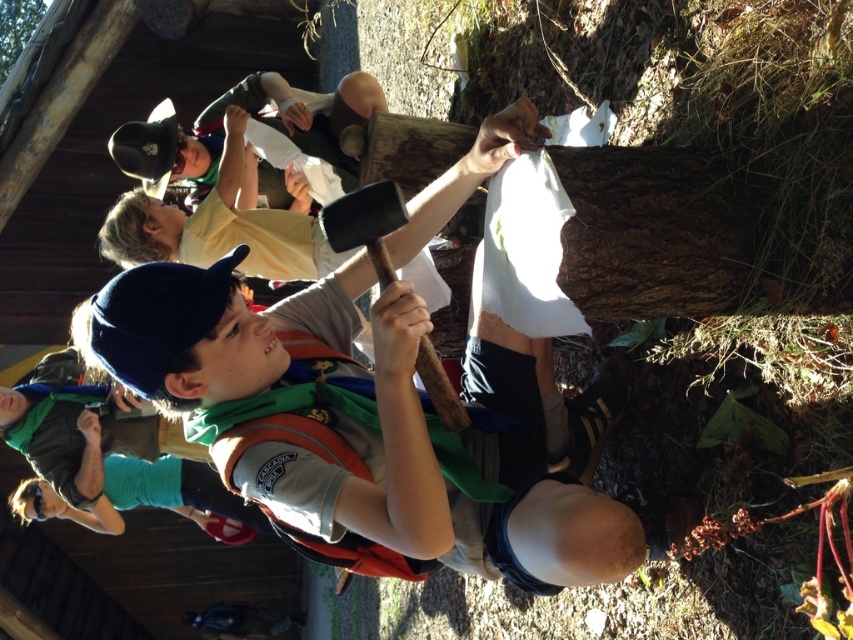
You are a photographer standing at the back of the scene. You want to take a photo of both the matte orange vest at center and the green fabric shirt at lower left. Can you see both objects clearly in your current position?

The matte orange vest at center is in front of the green fabric shirt at lower left, so the photographer might not be able to see the green fabric shirt at lower left clearly if the matte orange vest at center is blocking the view.

Consider the image. You are a scout leader trying to organize a game of capture the flag. The playing field is 5 meters wide. You have two scouts wearing the matte orange vest at center and green fabric shirt at lower left. Can both scouts stand on opposite sides of the field without overlapping?

The distance between the matte orange vest at center and green fabric shirt at lower left is 4.32 meters. Since the field is 5 meters wide, both scouts can stand on opposite sides without overlapping as the distance between them is less than the field width.